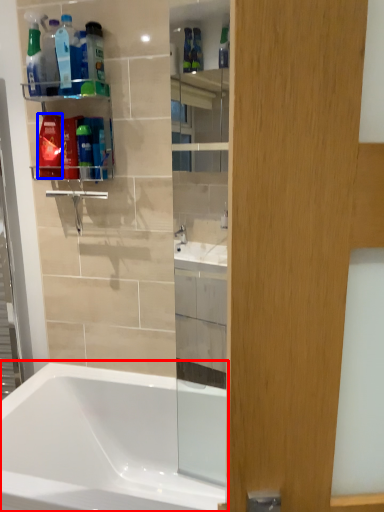
Question: Among these objects, which one is nearest to the camera, bathtub (highlighted by a red box) or mouthwash (highlighted by a blue box)?

Choices:
 (A) bathtub
 (B) mouthwash

Answer: (A)